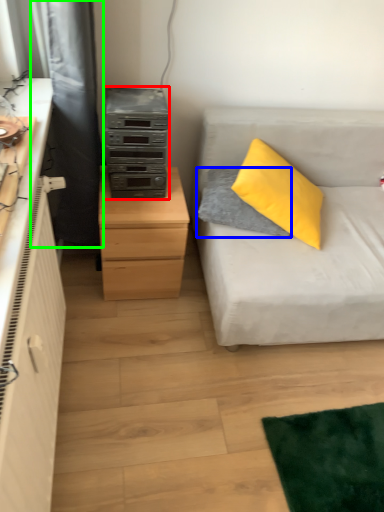
Question: Based on their relative distances, which object is nearer to stereo (highlighted by a red box)? Choose from pillow (highlighted by a blue box) and curtain (highlighted by a green box).

Choices:
 (A) pillow
 (B) curtain

Answer: (B)